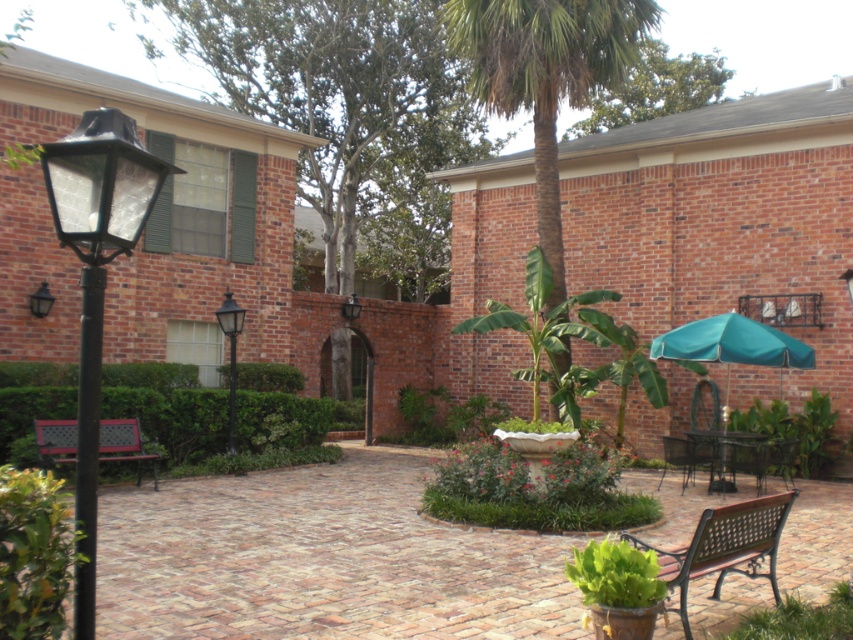
Question: Can you confirm if brown wooden bench at lower right is positioned above black glass lamp at left?

Choices:
 (A) no
 (B) yes

Answer: (A)

Question: Which point appears closest to the camera in this image?

Choices:
 (A) (755, 356)
 (B) (637, 508)
 (C) (44, 307)
 (D) (223, 310)

Answer: (B)

Question: Where is green leafy palm tree at center located in relation to white stone birdbath at center in the image?

Choices:
 (A) below
 (B) above

Answer: (B)

Question: Does green leafy palm tree at center appear on the left side of wooden bench at lower left?

Choices:
 (A) yes
 (B) no

Answer: (B)

Question: Which point is farther to the camera?

Choices:
 (A) (537, 134)
 (B) (49, 305)
 (C) (234, 353)

Answer: (A)

Question: Based on their relative distances, which object is farther from the green leafy palm tree at center?

Choices:
 (A) wooden bench at lower left
 (B) brown wooden bench at lower right

Answer: (B)